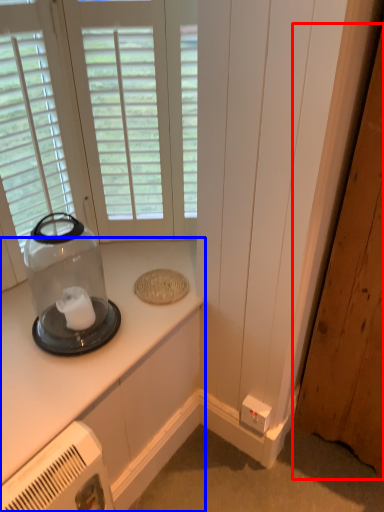
Question: Which of the following is the closest to the observer, door (highlighted by a red box) or countertop (highlighted by a blue box)?

Choices:
 (A) door
 (B) countertop

Answer: (A)